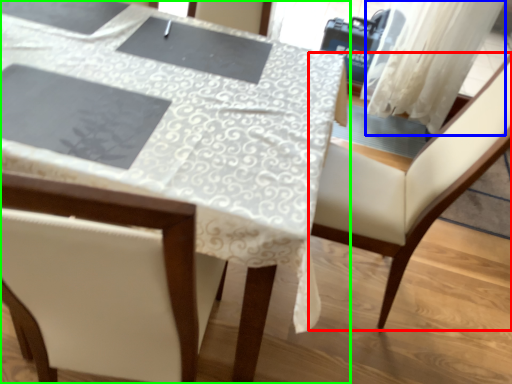
Question: Estimate the real-world distances between objects in this image. Which object is closer to chair (highlighted by a red box), curtain (highlighted by a blue box) or table (highlighted by a green box)?

Choices:
 (A) curtain
 (B) table

Answer: (B)